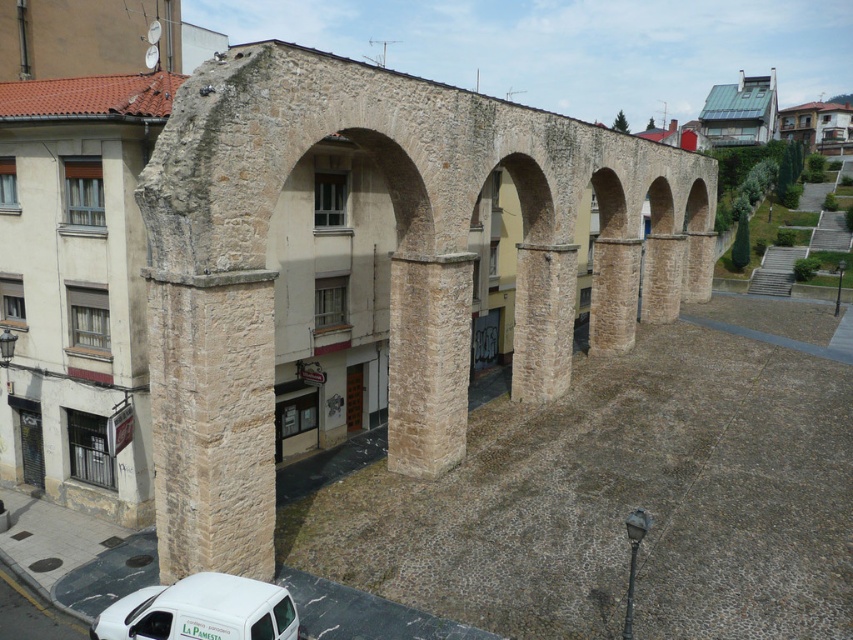
You are standing at the point marked as point (x=390, y=268). Which object is directly in front of you?

The natural stone viaduct at center is located at point (x=390, y=268), so the object directly in front of you is the natural stone viaduct at center.

You are a photographer planning to capture the natural stone viaduct at center and the white matte van at lower left in a single frame. Given their sizes, which object should you position closer to the camera to ensure both are visible in the composition?

The natural stone viaduct at center is larger in size than the white matte van at lower left. To ensure both are visible, you should position the white matte van at lower left closer to the camera, as its smaller size might require it to be nearer to balance the composition with the larger viaduct.